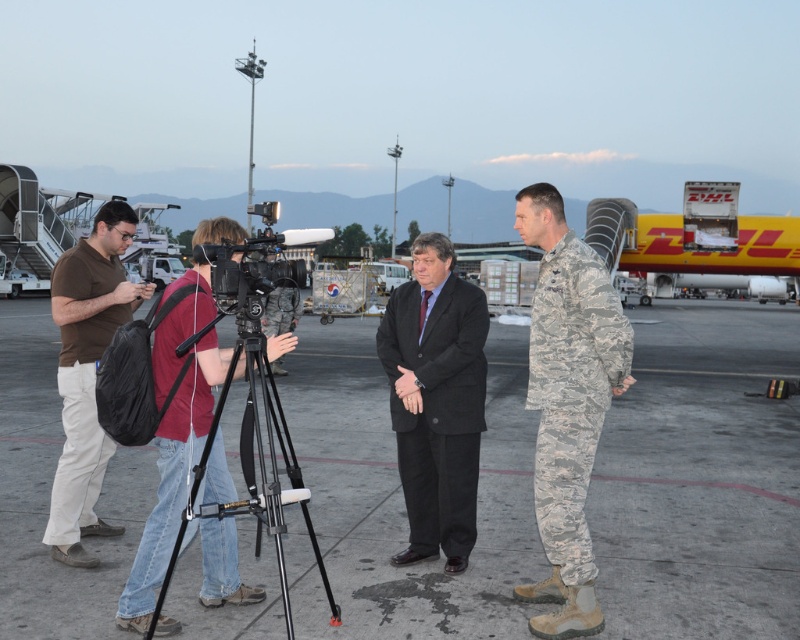
You are a drone operator trying to land a drone on the gray concrete tarmac at center. The drone has a landing pad at coordinates point (701, 477). Is the landing pad located on the gray concrete tarmac at center?

The gray concrete tarmac at center is represented by point (701, 477), so yes, the landing pad at coordinates point (701, 477) is located on the gray concrete tarmac at center.

You are a photographer setting up equipment on the airport tarmac during twilight. You have a camouflage fabric uniform at center and a black metal tripod at center in your view. Which object is narrower?

The camouflage fabric uniform at center is narrower than the black metal tripod at center.

You are a photographer standing at the edge of the airport tarmac during twilight. You need to position yourself so that both the camouflage fabric uniform at center and the black metal tripod at center are visible in your frame. Based on their positions, which object should you place on the left side of your camera view?

The camouflage fabric uniform at center is to the left of the black metal tripod at center, so you should place the camouflage fabric uniform at center on the left side of your camera view to capture both in the frame.